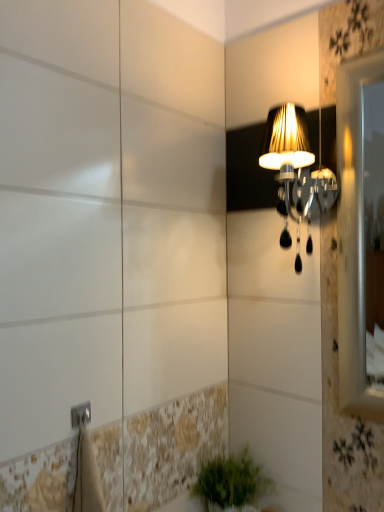
Question: Based on their positions, is matte black lampshade at upper right located to the left or right of green leafy plant at lower center?

Choices:
 (A) right
 (B) left

Answer: (A)

Question: Considering the positions of matte black lampshade at upper right and green leafy plant at lower center in the image, is matte black lampshade at upper right taller or shorter than green leafy plant at lower center?

Choices:
 (A) short
 (B) tall

Answer: (B)

Question: In terms of width, does matte black lampshade at upper right look wider or thinner when compared to green leafy plant at lower center?

Choices:
 (A) wide
 (B) thin

Answer: (A)

Question: Choose the correct answer: Is green leafy plant at lower center inside matte black lampshade at upper right or outside it?

Choices:
 (A) inside
 (B) outside

Answer: (B)

Question: Considering the relative positions of green leafy plant at lower center and matte black lampshade at upper right in the image provided, is green leafy plant at lower center to the left or to the right of matte black lampshade at upper right?

Choices:
 (A) left
 (B) right

Answer: (A)

Question: From the image's perspective, relative to matte black lampshade at upper right, is green leafy plant at lower center above or below?

Choices:
 (A) above
 (B) below

Answer: (B)

Question: Considering the positions of green leafy plant at lower center and matte black lampshade at upper right in the image, is green leafy plant at lower center taller or shorter than matte black lampshade at upper right?

Choices:
 (A) short
 (B) tall

Answer: (A)